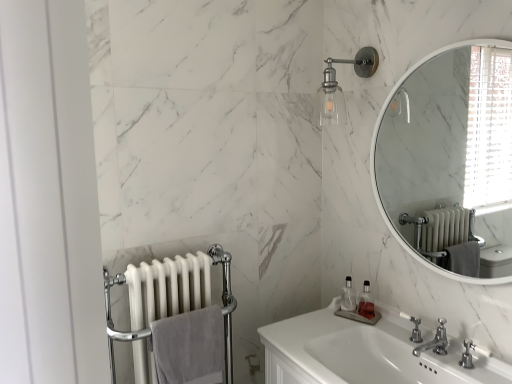
Question: Can you confirm if white glossy radiator at left is positioned to the right of white glossy sink at center?

Choices:
 (A) yes
 (B) no

Answer: (B)

Question: Is white glossy radiator at left facing towards white glossy sink at center?

Choices:
 (A) no
 (B) yes

Answer: (A)

Question: Would you say white glossy radiator at left is outside white glossy sink at center?

Choices:
 (A) yes
 (B) no

Answer: (A)

Question: Does white glossy radiator at left have a lesser width compared to white glossy sink at center?

Choices:
 (A) yes
 (B) no

Answer: (A)

Question: Is white glossy radiator at left positioned far away from white glossy sink at center?

Choices:
 (A) no
 (B) yes

Answer: (A)

Question: From the image's perspective, is white glossy radiator at left above white glossy sink at center?

Choices:
 (A) no
 (B) yes

Answer: (B)

Question: Considering the relative sizes of white plastic faucet at lower right, the first plumbing fixture positioned from the back, and white glossy sink at center in the image provided, is white plastic faucet at lower right, the first plumbing fixture positioned from the back, bigger than white glossy sink at center?

Choices:
 (A) no
 (B) yes

Answer: (A)

Question: Considering the relative sizes of white plastic faucet at lower right, the first plumbing fixture positioned from the back, and white glossy sink at center in the image provided, is white plastic faucet at lower right, the first plumbing fixture positioned from the back, thinner than white glossy sink at center?

Choices:
 (A) yes
 (B) no

Answer: (A)

Question: From a real-world perspective, is white plastic faucet at lower right, the second plumbing fixture positioned from the front, located higher than white glossy sink at center?

Choices:
 (A) yes
 (B) no

Answer: (A)

Question: Is white plastic faucet at lower right, the second plumbing fixture positioned from the front, positioned far away from white glossy sink at center?

Choices:
 (A) yes
 (B) no

Answer: (B)

Question: Considering the relative sizes of white plastic faucet at lower right, the first plumbing fixture positioned from the back, and white glossy sink at center in the image provided, is white plastic faucet at lower right, the first plumbing fixture positioned from the back, smaller than white glossy sink at center?

Choices:
 (A) no
 (B) yes

Answer: (B)

Question: Is the position of white plastic faucet at lower right, the first plumbing fixture positioned from the back, less distant than that of white glossy sink at center?

Choices:
 (A) no
 (B) yes

Answer: (A)

Question: Is the surface of clear glass sconce at upper center in direct contact with clear plastic soap dispenser at lower center, which is the second soap dispenser in right-to-left order?

Choices:
 (A) yes
 (B) no

Answer: (B)